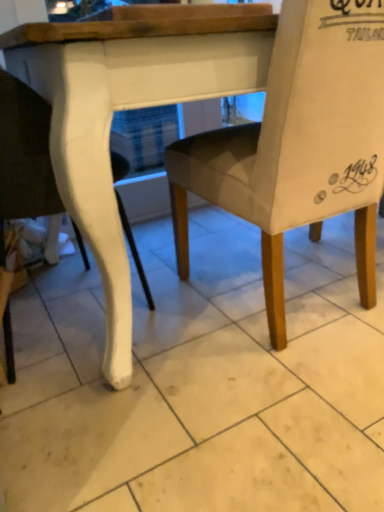
This screenshot has width=384, height=512. Identify the location of free space that is in between white glossy chair leg at left, which ranks as the 1th chair in left-to-right order, and light gray fabric chair at center, the second chair in the left-to-right sequence. (166, 340).